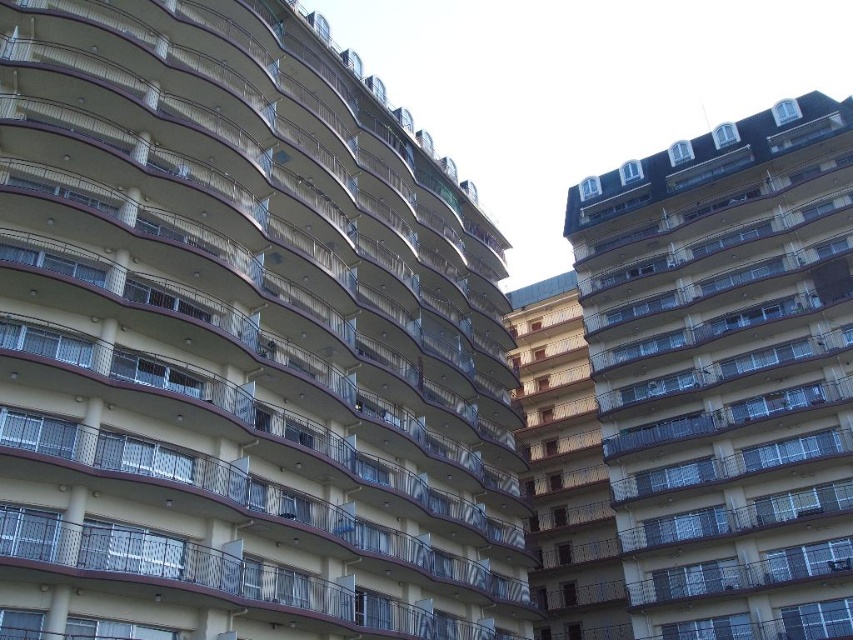
Consider the image. You are standing in front of the beige concrete building at center and the beige concrete balcony at center. Which one is higher?

The beige concrete building at center is taller than the beige concrete balcony at center.

You are a photographer standing at the base of the beige concrete building at center and the beige concrete balcony at center. You want to capture both structures in a single wide shot without moving your position. Which structure will appear wider in the photo?

The beige concrete building at center will appear wider in the photo because its width surpasses that of the beige concrete balcony at center according to the description.